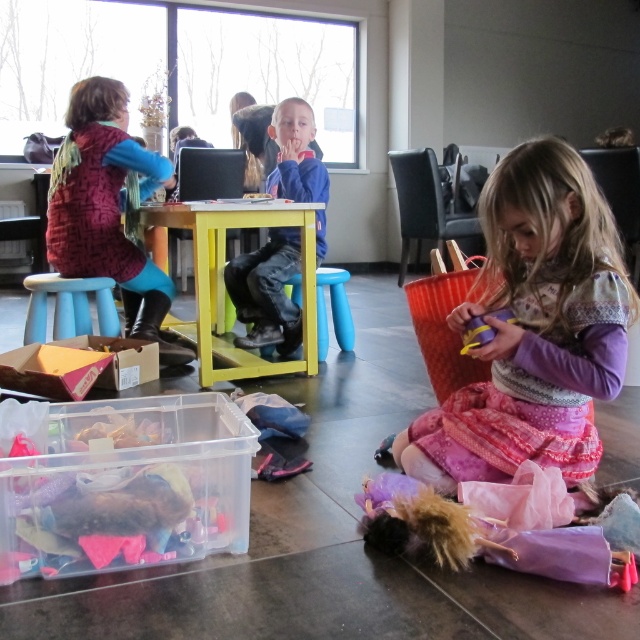
Please provide the 2D coordinates of the yellow painted wood table at center in the image. The coordinates should be in the format of a point with two decimal places, such as point 0.444, 0.350. The scene is a lively indoor scene with children playing in a community center. The table is yellow, made of wood, and located at the center of the image. You must use the exact object label from the Objects section in your answer.

The yellow painted wood table at center is located at point (224, 284).